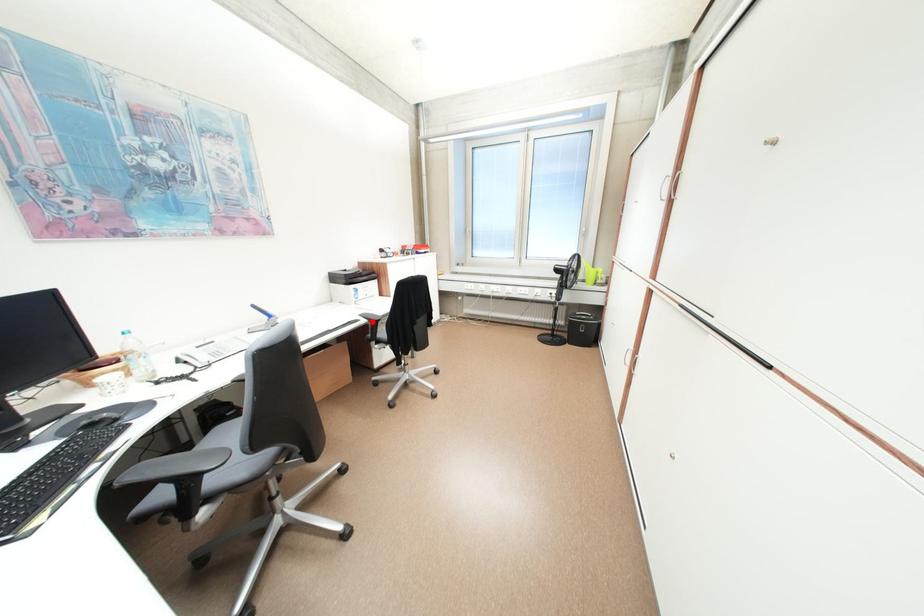
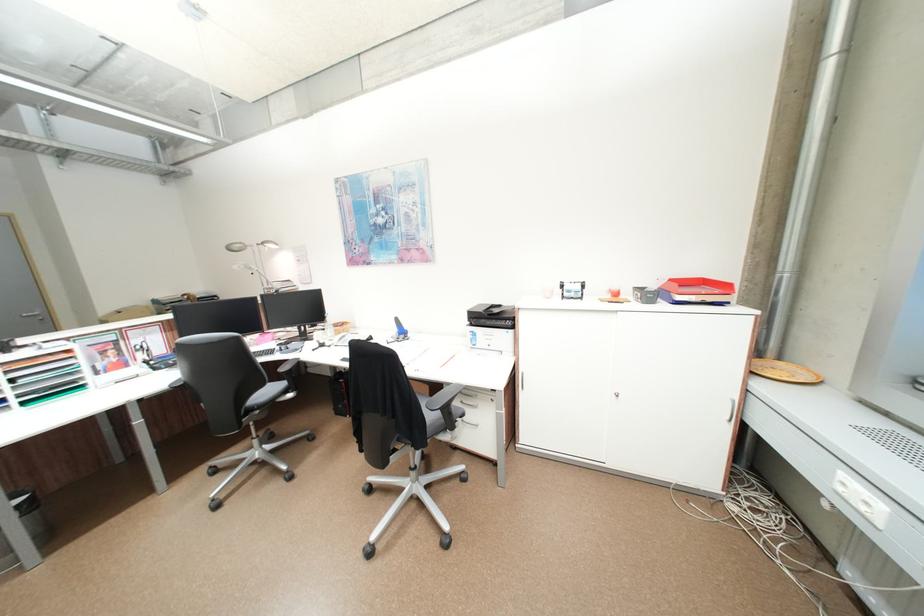
Question: I am providing you with two images of the same scene from different viewpoints. A red point is marked on the first image. At the location where the point appears in image 1, is it still visible in image 2?

Choices:
 (A) Yes
 (B) No

Answer: (B)